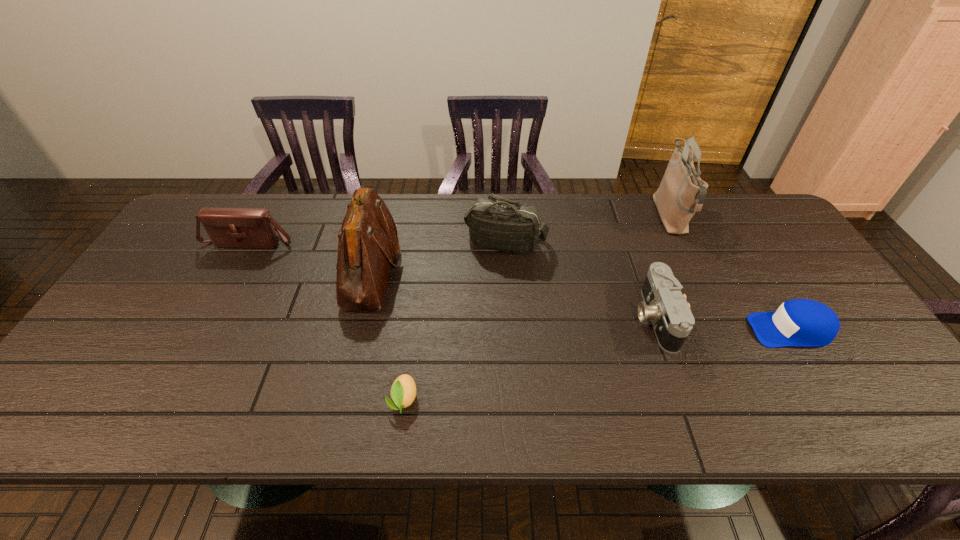
Where is `the sixth object from left to right`? The height and width of the screenshot is (540, 960). the sixth object from left to right is located at coordinates (681, 193).

Where is `the second object from left to right`? Image resolution: width=960 pixels, height=540 pixels. the second object from left to right is located at coordinates (367, 243).

Where is `the second shoulder bag from right to left`? the second shoulder bag from right to left is located at coordinates (496, 223).

Image resolution: width=960 pixels, height=540 pixels. I want to click on the fourth object from left to right, so click(496, 223).

This screenshot has height=540, width=960. What are the coordinates of `the leftmost shoulder bag` in the screenshot? It's located at (227, 227).

I want to click on the fourth tallest object, so click(x=227, y=227).

I want to click on camera, so click(672, 320).

You are a GUI agent. You are given a task and a screenshot of the screen. Output one action in this format:
    pyautogui.click(x=<x>, y=<y>)
    Task: Click on the fifth tallest object
    This screenshot has height=540, width=960.
    Given the screenshot: What is the action you would take?
    pyautogui.click(x=672, y=320)

Identify the location of the rightmost object. The height and width of the screenshot is (540, 960). (799, 322).

Identify the location of the sixth tallest object. (799, 322).